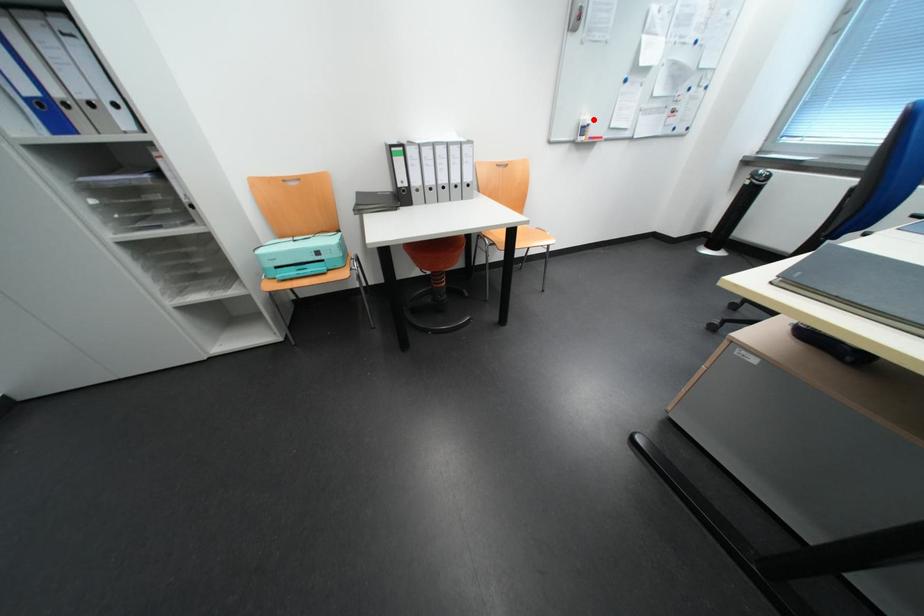
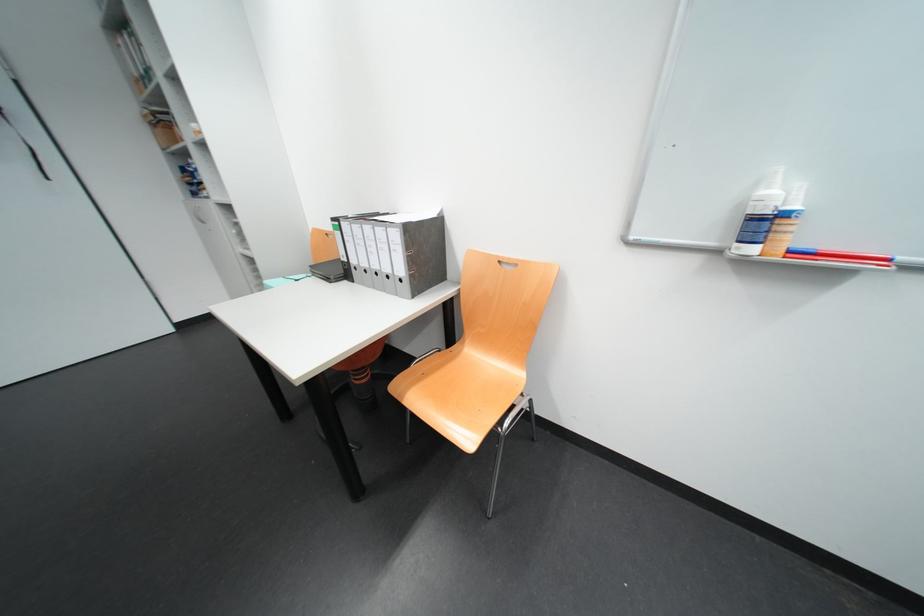
In the second image, find the point that corresponds to the highlighted location in the first image.

(773, 193)